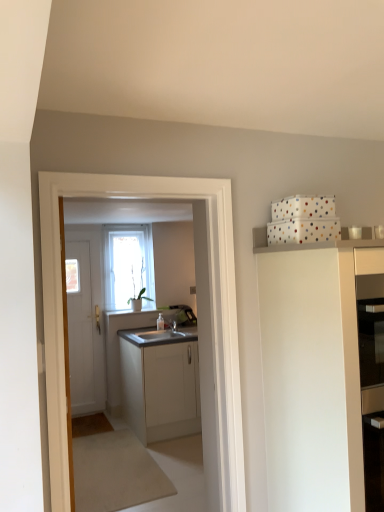
Question: Is white matte cabinet at upper right, the 2th cabinetry when ordered from back to front, not near white matte door at left?

Choices:
 (A) yes
 (B) no

Answer: (A)

Question: Is white matte cabinet at upper right, which is the first cabinetry in right-to-left order, bigger than white matte door at left?

Choices:
 (A) yes
 (B) no

Answer: (A)

Question: Is white matte cabinet at upper right, the 2th cabinetry when ordered from back to front, positioned before white matte door at left?

Choices:
 (A) no
 (B) yes

Answer: (B)

Question: From the image's perspective, is white matte cabinet at upper right, the 1th cabinetry in the front-to-back sequence, located beneath white matte door at left?

Choices:
 (A) no
 (B) yes

Answer: (A)

Question: From a real-world perspective, is white matte cabinet at upper right, the 1th cabinetry in the front-to-back sequence, physically below white matte door at left?

Choices:
 (A) no
 (B) yes

Answer: (B)

Question: Visually, is white matte cabinet at center, the second cabinetry in the right-to-left sequence, positioned to the left or to the right of white matte cabinet at upper right, the 1th cabinetry in the front-to-back sequence?

Choices:
 (A) left
 (B) right

Answer: (A)

Question: Looking at the image, does white matte cabinet at center, the second cabinetry in the right-to-left sequence, seem bigger or smaller compared to white matte cabinet at upper right, which is the first cabinetry in right-to-left order?

Choices:
 (A) small
 (B) big

Answer: (B)

Question: From the image's perspective, relative to white matte cabinet at upper right, the 1th cabinetry in the front-to-back sequence, is white matte cabinet at center, which ranks as the first cabinetry in back-to-front order, above or below?

Choices:
 (A) below
 (B) above

Answer: (A)

Question: Considering the positions of point (167, 409) and point (347, 287), is point (167, 409) closer or farther from the camera than point (347, 287)?

Choices:
 (A) farther
 (B) closer

Answer: (A)

Question: From a real-world perspective, is white matte cabinet at center, the second cabinetry from the front, above or below transparent glass window at center?

Choices:
 (A) above
 (B) below

Answer: (B)

Question: In terms of size, does white matte cabinet at center, the second cabinetry from the front, appear bigger or smaller than transparent glass window at center?

Choices:
 (A) small
 (B) big

Answer: (B)

Question: Do you think white matte cabinet at center, which ranks as the first cabinetry in back-to-front order, is within transparent glass window at center, or outside of it?

Choices:
 (A) outside
 (B) inside

Answer: (A)

Question: From the image's perspective, is white matte cabinet at center, the second cabinetry from the front, above or below transparent glass window at center?

Choices:
 (A) below
 (B) above

Answer: (A)

Question: Considering the positions of white matte cabinet at center, the second cabinetry in the right-to-left sequence, and white matte door at left in the image, is white matte cabinet at center, the second cabinetry in the right-to-left sequence, taller or shorter than white matte door at left?

Choices:
 (A) tall
 (B) short

Answer: (B)

Question: Choose the correct answer: Is white matte cabinet at center, the second cabinetry from the front, inside white matte door at left or outside it?

Choices:
 (A) outside
 (B) inside

Answer: (A)